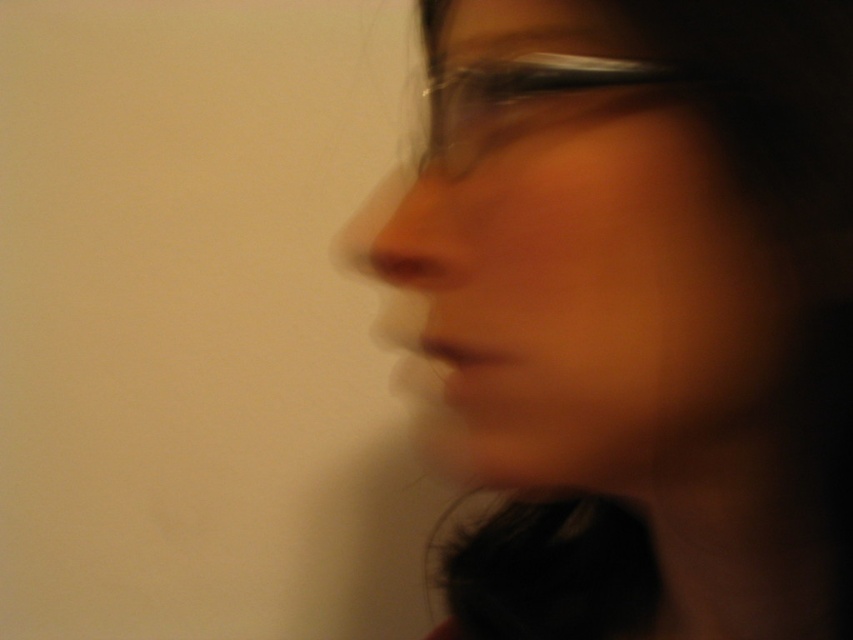
Who is taller, smooth skin face at center or transparent plastic glasses at center?

Standing taller between the two is smooth skin face at center.

Can you confirm if smooth skin face at center is shorter than transparent plastic glasses at center?

No, smooth skin face at center is not shorter than transparent plastic glasses at center.

Where is `smooth skin face at center`? Image resolution: width=853 pixels, height=640 pixels. smooth skin face at center is located at coordinates (593, 289).